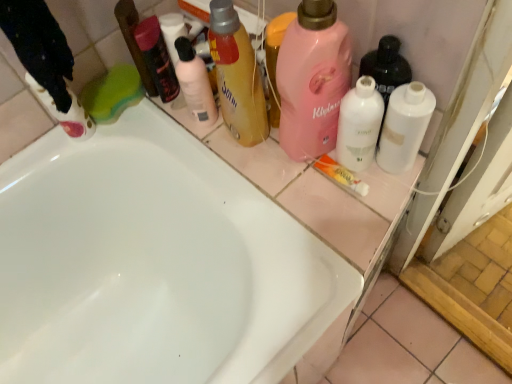
Question: From the image's perspective, is matte black mouthwash at upper center on white matte bottle at right, which appears as the 1th cleaning product when viewed from the right?

Choices:
 (A) no
 (B) yes

Answer: (B)

Question: Can you confirm if matte black mouthwash at upper center is taller than white matte bottle at right, acting as the seventh cleaning product starting from the left?

Choices:
 (A) no
 (B) yes

Answer: (A)

Question: Considering the relative positions of matte black mouthwash at upper center and white matte bottle at right, acting as the seventh cleaning product starting from the left, in the image provided, is matte black mouthwash at upper center to the left of white matte bottle at right, acting as the seventh cleaning product starting from the left, from the viewer's perspective?

Choices:
 (A) no
 (B) yes

Answer: (B)

Question: Does matte black mouthwash at upper center have a lesser height compared to white matte bottle at right, acting as the seventh cleaning product starting from the left?

Choices:
 (A) no
 (B) yes

Answer: (B)

Question: Is matte black mouthwash at upper center oriented towards white matte bottle at right, acting as the seventh cleaning product starting from the left?

Choices:
 (A) yes
 (B) no

Answer: (B)

Question: In the image, is white glossy bottle at center, which appears as the 6th cleaning product when viewed from the left, positioned in front of or behind white glossy bathtub at center?

Choices:
 (A) behind
 (B) front

Answer: (A)

Question: Based on their sizes in the image, would you say white glossy bottle at center, which appears as the second cleaning product when viewed from the right, is bigger or smaller than white glossy bathtub at center?

Choices:
 (A) big
 (B) small

Answer: (B)

Question: From a real-world perspective, is white glossy bottle at center, which appears as the 6th cleaning product when viewed from the left, positioned above or below white glossy bathtub at center?

Choices:
 (A) above
 (B) below

Answer: (A)

Question: From the image's perspective, is white glossy bottle at center, which appears as the second cleaning product when viewed from the right, located above or below white glossy bathtub at center?

Choices:
 (A) above
 (B) below

Answer: (A)

Question: Is matte pink bottle at upper center, which is the 5th cleaning product from right to left, in front of or behind white matte bottle at right, which appears as the 1th cleaning product when viewed from the right, in the image?

Choices:
 (A) front
 (B) behind

Answer: (B)

Question: Is matte pink bottle at upper center, which is counted as the third cleaning product, starting from the left, wider or thinner than white matte bottle at right, acting as the seventh cleaning product starting from the left?

Choices:
 (A) wide
 (B) thin

Answer: (B)

Question: In terms of size, does matte pink bottle at upper center, which is the 5th cleaning product from right to left, appear bigger or smaller than white matte bottle at right, which appears as the 1th cleaning product when viewed from the right?

Choices:
 (A) big
 (B) small

Answer: (B)

Question: From the image's perspective, is matte pink bottle at upper center, which is the 5th cleaning product from right to left, located above or below white matte bottle at right, acting as the seventh cleaning product starting from the left?

Choices:
 (A) below
 (B) above

Answer: (B)

Question: Considering the positions of green sponge at upper left, which appears as the second cleaning product when viewed from the left, and white glossy bathtub at center in the image, is green sponge at upper left, which appears as the second cleaning product when viewed from the left, taller or shorter than white glossy bathtub at center?

Choices:
 (A) short
 (B) tall

Answer: (A)

Question: From a real-world perspective, relative to white glossy bathtub at center, is green sponge at upper left, which is the 6th cleaning product from right to left, vertically above or below?

Choices:
 (A) above
 (B) below

Answer: (A)